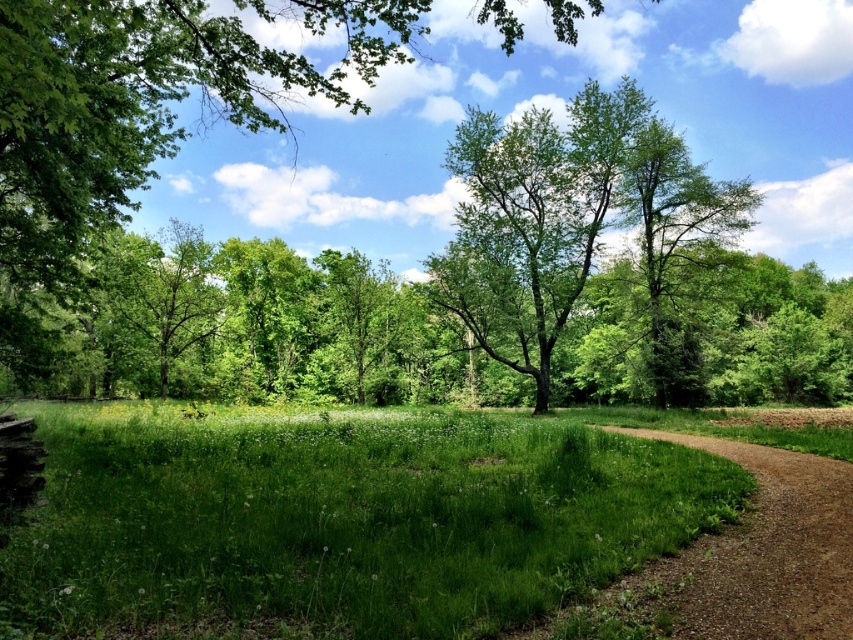
You are planning to take a nap in the scene. You want to choose between the green leafy tree at upper center and the rustic wooden bench at lower left. Which option provides more shade?

The green leafy tree at upper center is bigger than the rustic wooden bench at lower left, so it provides more shade.

You are standing at the rustic wooden bench at lower left and want to walk towards the green leafy tree at upper center. Which direction should you head?

The green leafy tree at upper center is to the left of the rustic wooden bench at lower left, so you should head to the left to reach it.

You are standing at the starting point of the dirt path in the bottom right corner of the meadow. You see two points marked in the scene, point 1 at coordinates point 1 at point (x=343, y=573) and point 2 at point (x=155, y=246). Which point is closer to you as you stand at the starting point?

Point 1 at point (x=343, y=573) is closer to the camera than point 2 at point (x=155, y=246), so it is closer to you as you stand at the starting point.